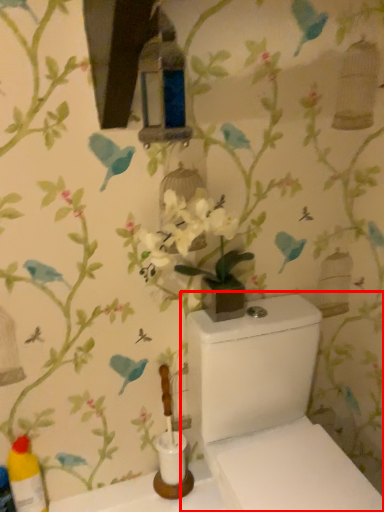
Question: From the image's perspective, what is the correct spatial relationship of toilet (annotated by the red box) in relation to bottle?

Choices:
 (A) above
 (B) below

Answer: (A)